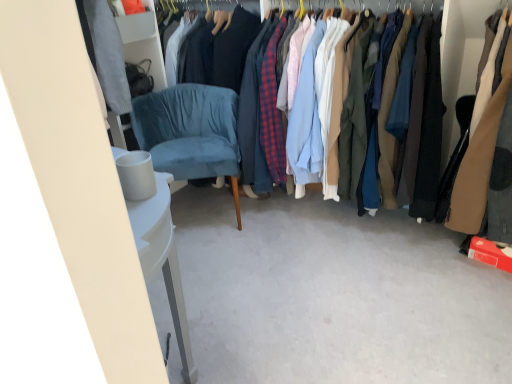
Question: Is matte cotton shirts at center, which is counted as the 2th clothing, starting from the right, at the right side of velvet blue armchair at center-left?

Choices:
 (A) yes
 (B) no

Answer: (A)

Question: Could you tell me if matte cotton shirts at center, which is counted as the 2th clothing, starting from the right, is facing velvet blue armchair at center-left?

Choices:
 (A) no
 (B) yes

Answer: (A)

Question: Considering the relative sizes of matte cotton shirts at center, arranged as the 1th clothing when viewed from the left, and velvet blue armchair at center-left in the image provided, is matte cotton shirts at center, arranged as the 1th clothing when viewed from the left, smaller than velvet blue armchair at center-left?

Choices:
 (A) no
 (B) yes

Answer: (A)

Question: Is matte cotton shirts at center, which is counted as the 2th clothing, starting from the right, positioned with its back to velvet blue armchair at center-left?

Choices:
 (A) yes
 (B) no

Answer: (B)

Question: Does matte cotton shirts at center, arranged as the 1th clothing when viewed from the left, have a larger size compared to velvet blue armchair at center-left?

Choices:
 (A) yes
 (B) no

Answer: (A)

Question: From the image's perspective, is white matte trash bin at lower left above or below brown leather jacket at right, which appears as the first clothing when viewed from the right?

Choices:
 (A) below
 (B) above

Answer: (A)

Question: Relative to brown leather jacket at right, the second clothing viewed from the left, is white matte trash bin at lower left in front or behind?

Choices:
 (A) front
 (B) behind

Answer: (A)

Question: Considering the positions of white matte trash bin at lower left and brown leather jacket at right, which appears as the first clothing when viewed from the right, in the image, is white matte trash bin at lower left bigger or smaller than brown leather jacket at right, which appears as the first clothing when viewed from the right,?

Choices:
 (A) big
 (B) small

Answer: (B)

Question: Considering the positions of point (121, 162) and point (463, 213), is point (121, 162) closer or farther from the camera than point (463, 213)?

Choices:
 (A) closer
 (B) farther

Answer: (A)

Question: In terms of height, does brown leather jacket at right, the second clothing viewed from the left, look taller or shorter compared to matte cotton shirts at center, which is counted as the 2th clothing, starting from the right?

Choices:
 (A) tall
 (B) short

Answer: (B)

Question: From a real-world perspective, is brown leather jacket at right, which appears as the first clothing when viewed from the right, physically located above or below matte cotton shirts at center, which is counted as the 2th clothing, starting from the right?

Choices:
 (A) below
 (B) above

Answer: (B)

Question: Choose the correct answer: Is brown leather jacket at right, the second clothing viewed from the left, inside matte cotton shirts at center, which is counted as the 2th clothing, starting from the right, or outside it?

Choices:
 (A) inside
 (B) outside

Answer: (B)

Question: Is brown leather jacket at right, the second clothing viewed from the left, to the left or to the right of matte cotton shirts at center, arranged as the 1th clothing when viewed from the left, in the image?

Choices:
 (A) left
 (B) right

Answer: (B)

Question: From a real-world perspective, relative to matte cotton shirts at center, arranged as the 1th clothing when viewed from the left, is white matte trash bin at lower left vertically above or below?

Choices:
 (A) above
 (B) below

Answer: (A)

Question: Is white matte trash bin at lower left inside the boundaries of matte cotton shirts at center, arranged as the 1th clothing when viewed from the left, or outside?

Choices:
 (A) inside
 (B) outside

Answer: (B)